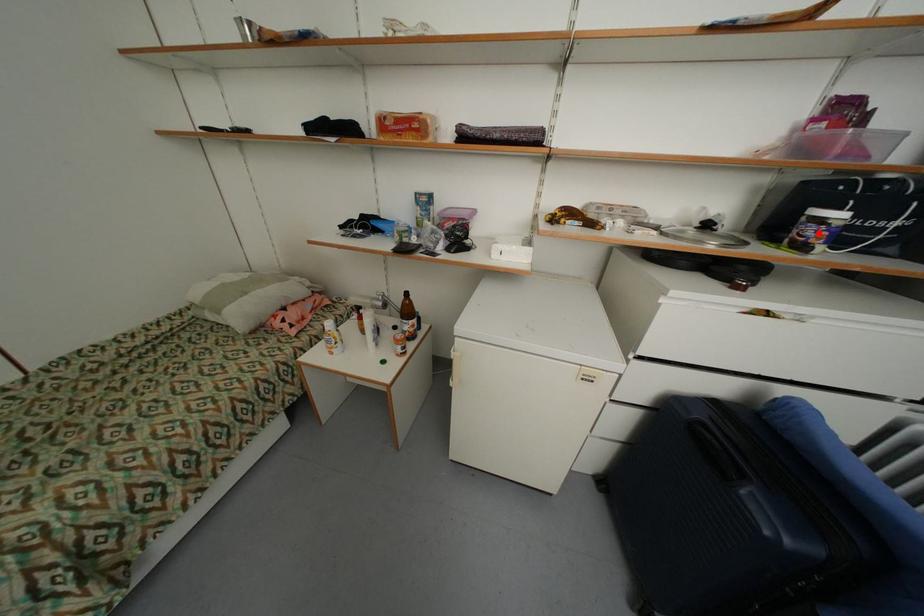
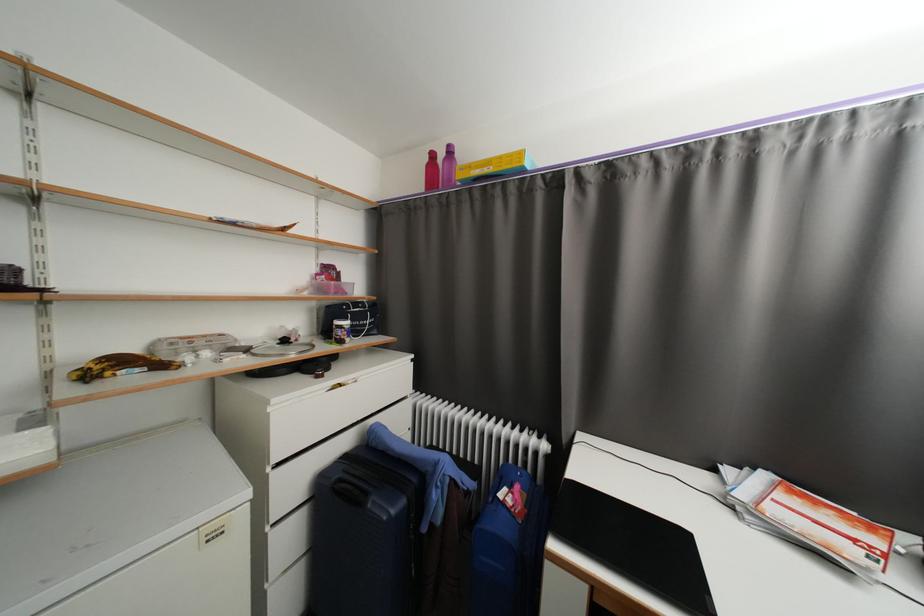
The point at the highlighted location is marked in the first image. Where is the corresponding point in the second image?

(346, 334)